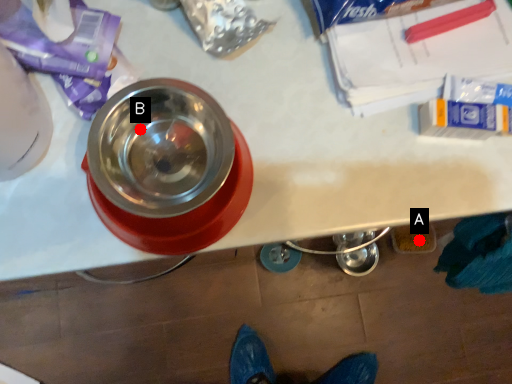
Question: Two points are circled on the image, labeled by A and B beside each circle. Which point is further to the camera?

Choices:
 (A) A is further
 (B) B is further

Answer: (A)